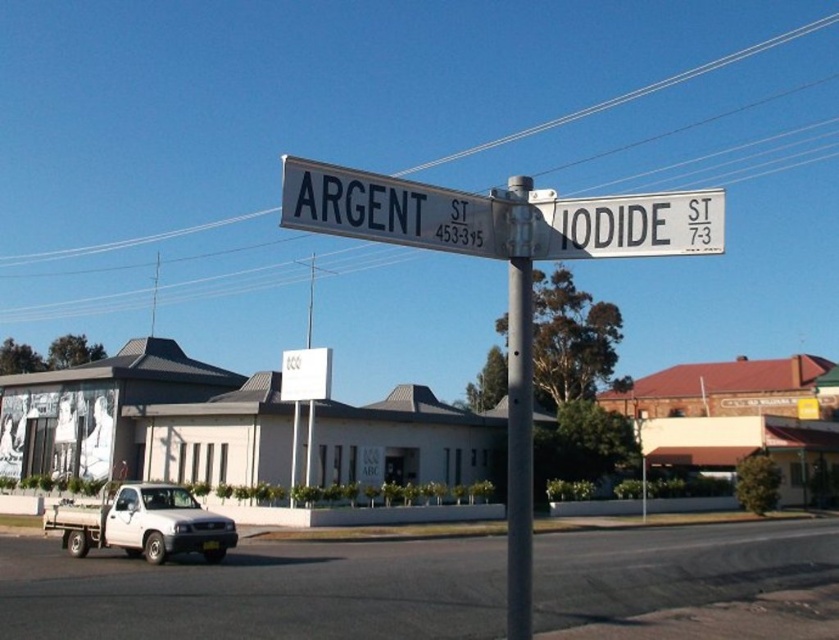
You are a delivery driver who needs to park your white plastic truck at lower left near the gray metallic pole at center. According to the scene, where should you position the truck relative to the pole?

The white plastic truck at lower left should be positioned below the gray metallic pole at center as it is already located below it in the scene.